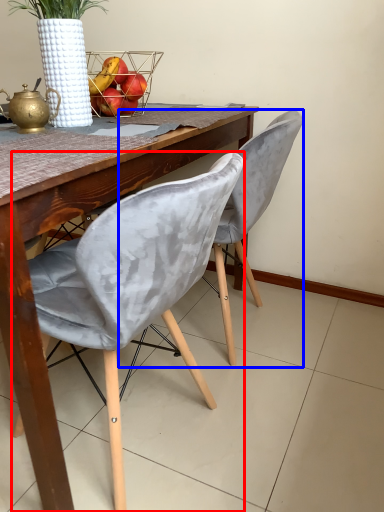
Question: Which object is closer to the camera taking this photo, chair (highlighted by a red box) or chair (highlighted by a blue box)?

Choices:
 (A) chair
 (B) chair

Answer: (A)